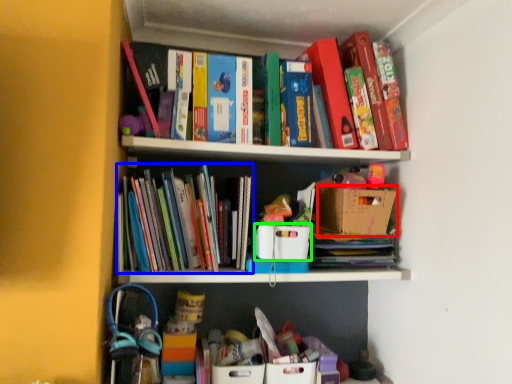
Question: Which is nearer to the cardboard box (highlighted by a red box)? book (highlighted by a blue box) or cardboard box (highlighted by a green box).

Choices:
 (A) book
 (B) cardboard box

Answer: (B)